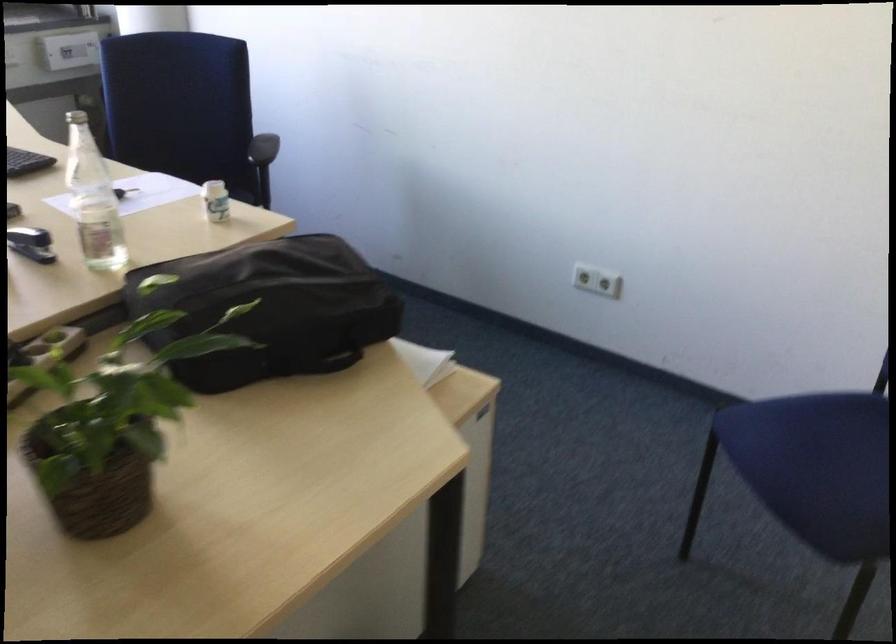
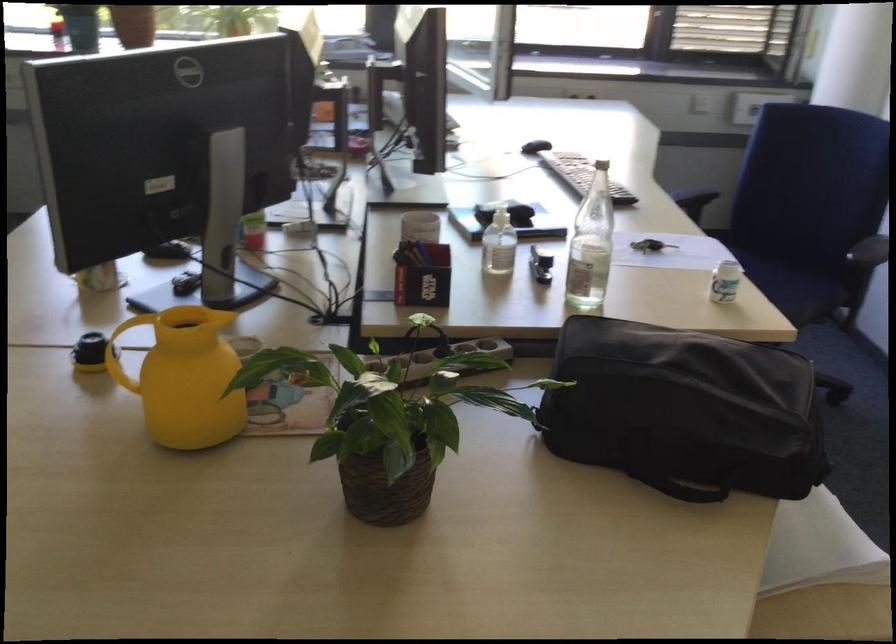
Where in the second image is the point corresponding to the point at 106,212 from the first image?

(590, 245)